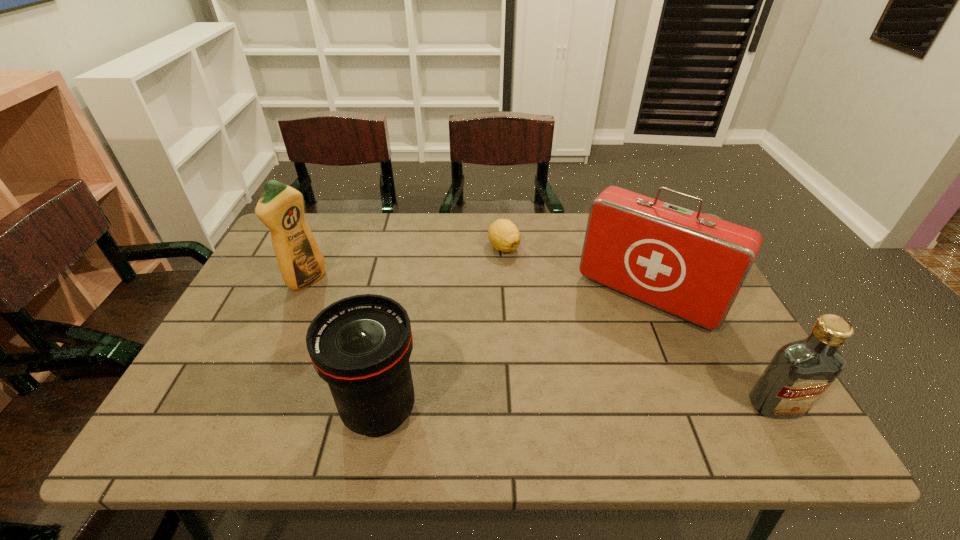
This screenshot has height=540, width=960. Find the location of `free region that satisfies the following two spatial constraints: 1. on the back side of the leftmost object; 2. on the right side of the farthest object`. free region that satisfies the following two spatial constraints: 1. on the back side of the leftmost object; 2. on the right side of the farthest object is located at coordinates (322, 247).

Find the location of a particular element. free location that satisfies the following two spatial constraints: 1. on the back side of the detergent; 2. on the left side of the shortest object is located at coordinates (322, 247).

Find the location of a particular element. This screenshot has width=960, height=540. vacant position in the image that satisfies the following two spatial constraints: 1. on the front side of the shortest object; 2. on the right side of the first-aid kit is located at coordinates pos(507,296).

Identify the location of vacant space that satisfies the following two spatial constraints: 1. on the back side of the first-aid kit; 2. on the left side of the second object from left to right. Image resolution: width=960 pixels, height=540 pixels. (401, 296).

The image size is (960, 540). Identify the location of vacant area that satisfies the following two spatial constraints: 1. on the front side of the detergent; 2. on the right side of the second object from left to right. (249, 410).